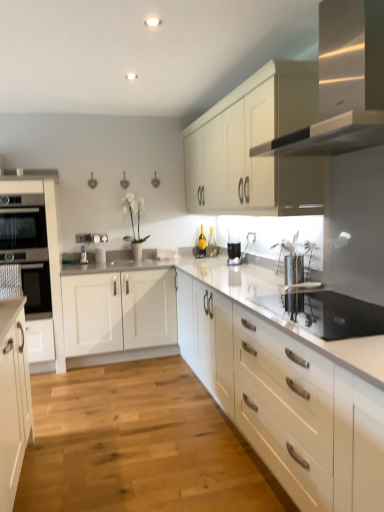
Question: Could you tell me if satin white oven at left, the 1th cabinetry positioned from the left, is facing satin silver range hood at upper right?

Choices:
 (A) yes
 (B) no

Answer: (B)

Question: Considering the relative sizes of satin white oven at left, the third cabinetry viewed from the right, and satin silver range hood at upper right in the image provided, is satin white oven at left, the third cabinetry viewed from the right, taller than satin silver range hood at upper right?

Choices:
 (A) no
 (B) yes

Answer: (B)

Question: Can you confirm if satin white oven at left, the 1th cabinetry positioned from the left, is positioned to the left of satin silver range hood at upper right?

Choices:
 (A) yes
 (B) no

Answer: (A)

Question: Is the position of satin white oven at left, the third cabinetry viewed from the right, less distant than that of satin silver range hood at upper right?

Choices:
 (A) no
 (B) yes

Answer: (A)

Question: From the image's perspective, is satin white oven at left, the 1th cabinetry positioned from the left, on satin silver range hood at upper right?

Choices:
 (A) no
 (B) yes

Answer: (A)

Question: Choose the correct answer: Is stainless steel oven at center inside light wood floor at center or outside it?

Choices:
 (A) inside
 (B) outside

Answer: (B)

Question: Considering their positions, is stainless steel oven at center located in front of or behind light wood floor at center?

Choices:
 (A) front
 (B) behind

Answer: (A)

Question: Is stainless steel oven at center taller or shorter than light wood floor at center?

Choices:
 (A) short
 (B) tall

Answer: (B)

Question: Considering the positions of stainless steel oven at center and light wood floor at center in the image, is stainless steel oven at center wider or thinner than light wood floor at center?

Choices:
 (A) wide
 (B) thin

Answer: (B)

Question: Considering the positions of stainless steel oven at center and satin nickel faucet at center in the image, is stainless steel oven at center wider or thinner than satin nickel faucet at center?

Choices:
 (A) thin
 (B) wide

Answer: (B)

Question: From a real-world perspective, relative to satin nickel faucet at center, is stainless steel oven at center vertically above or below?

Choices:
 (A) below
 (B) above

Answer: (A)

Question: Is point (326, 334) positioned closer to the camera than point (86, 245)?

Choices:
 (A) farther
 (B) closer

Answer: (B)

Question: Considering the positions of stainless steel oven at center and satin nickel faucet at center in the image, is stainless steel oven at center bigger or smaller than satin nickel faucet at center?

Choices:
 (A) small
 (B) big

Answer: (B)

Question: Based on their sizes in the image, would you say light wood floor at center is bigger or smaller than white matte cabinet at center, the third cabinetry from the left?

Choices:
 (A) small
 (B) big

Answer: (A)

Question: Is light wood floor at center inside the boundaries of white matte cabinet at center, the third cabinetry from the left, or outside?

Choices:
 (A) outside
 (B) inside

Answer: (A)